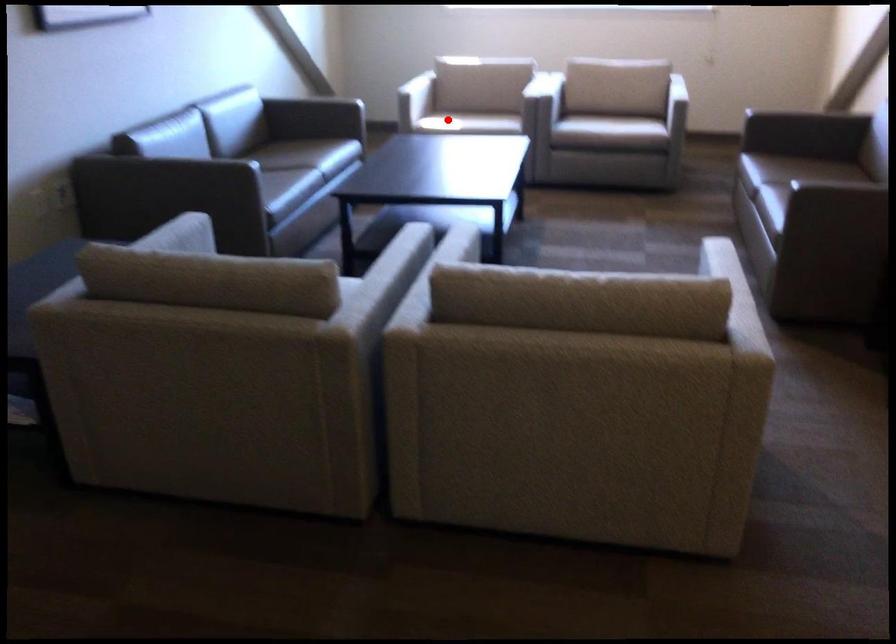
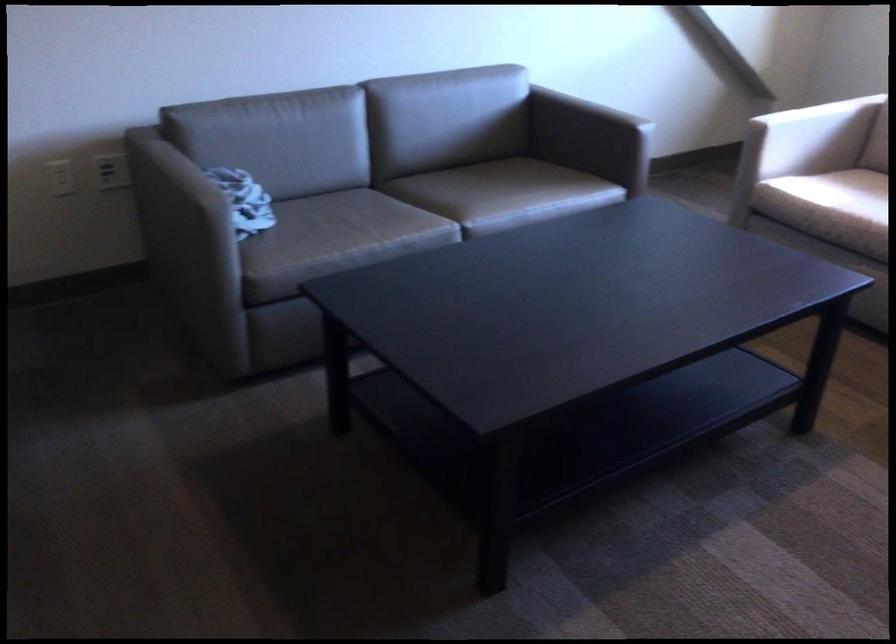
Question: I am providing you with two images of the same scene from different viewpoints. Given a red point in image1, look at the same physical point in image2. Is it:

Choices:
 (A) Closer to the viewpoint
 (B) Farther from the viewpoint

Answer: (A)